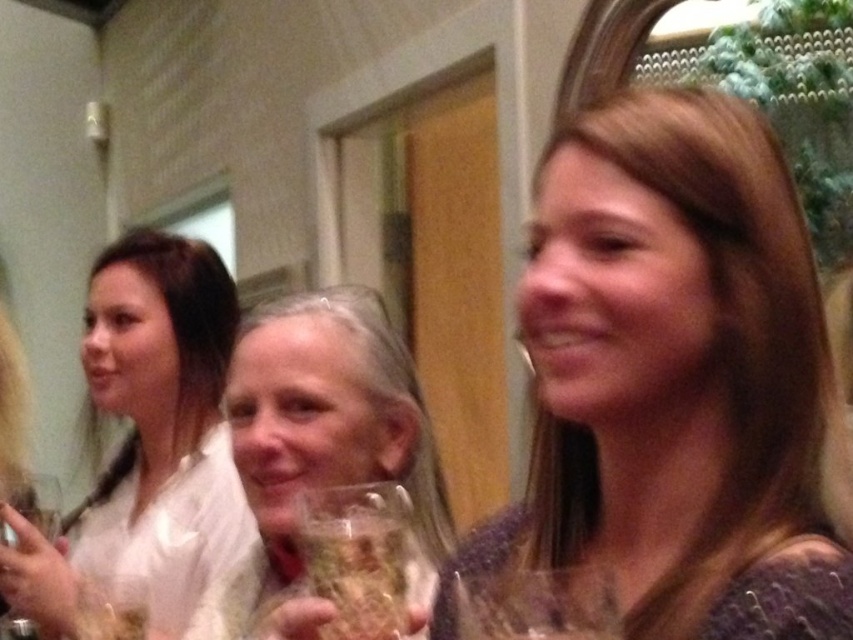
Looking at this image, is matte white blouse at left above translucent glass wine glass at center?

Incorrect, matte white blouse at left is not positioned above translucent glass wine glass at center.

The width and height of the screenshot is (853, 640). What do you see at coordinates (148, 440) in the screenshot? I see `matte white blouse at left` at bounding box center [148, 440].

Locate an element on the screen. Image resolution: width=853 pixels, height=640 pixels. matte white blouse at left is located at coordinates (148, 440).

Locate an element on the screen. This screenshot has width=853, height=640. matte white blouse at left is located at coordinates (148, 440).

Can you confirm if matte purple dress at center is thinner than translucent glass wine glass at center?

Incorrect, matte purple dress at center's width is not less than translucent glass wine glass at center's.

Looking at this image, does matte purple dress at center have a greater height compared to translucent glass wine glass at center?

Correct, matte purple dress at center is much taller as translucent glass wine glass at center.

Does point (793, 636) come farther from viewer compared to point (561, 604)?

That is True.

I want to click on matte purple dress at center, so click(x=676, y=380).

Between matte purple dress at center and clear glass wine glass at lower left, which one appears on the right side from the viewer's perspective?

matte purple dress at center is more to the right.

Which of these two, matte purple dress at center or clear glass wine glass at lower left, stands taller?

Standing taller between the two is matte purple dress at center.

What do you see at coordinates (676, 380) in the screenshot? This screenshot has height=640, width=853. I see `matte purple dress at center` at bounding box center [676, 380].

Identify the location of matte purple dress at center. (676, 380).